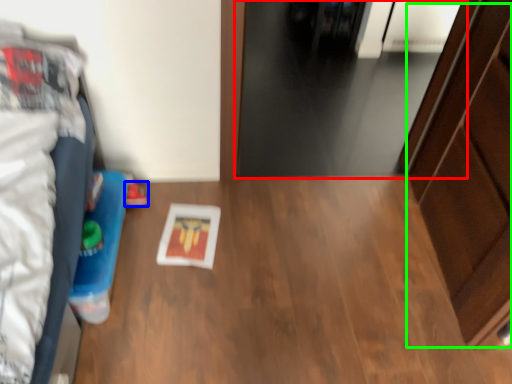
Question: Estimate the real-world distances between objects in this image. Which object is closer to door (highlighted by a red box), footwear (highlighted by a blue box) or dresser (highlighted by a green box)?

Choices:
 (A) footwear
 (B) dresser

Answer: (B)